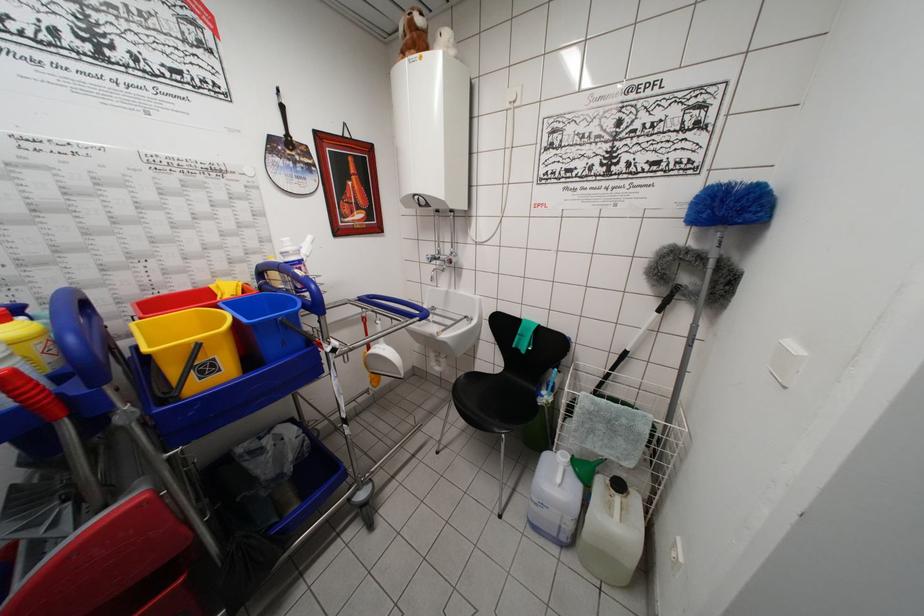
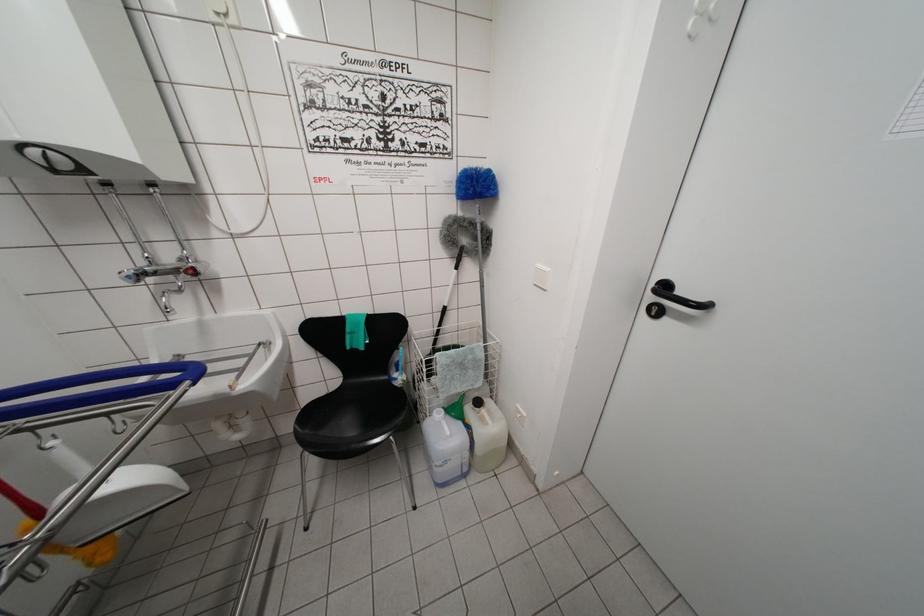
Find the pixel in the second image that matches point 432,262 in the first image.

(131, 282)